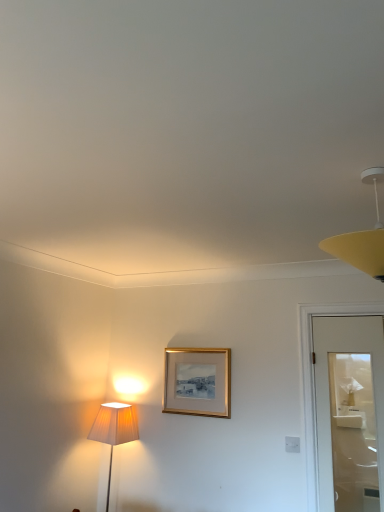
Question: Is yellow matte lampshade at upper right aimed at gold metallic picture frame at center?

Choices:
 (A) no
 (B) yes

Answer: (A)

Question: Can you confirm if yellow matte lampshade at upper right is wider than gold metallic picture frame at center?

Choices:
 (A) yes
 (B) no

Answer: (A)

Question: Can you confirm if yellow matte lampshade at upper right is shorter than gold metallic picture frame at center?

Choices:
 (A) no
 (B) yes

Answer: (B)

Question: Does yellow matte lampshade at upper right have a greater height compared to gold metallic picture frame at center?

Choices:
 (A) yes
 (B) no

Answer: (B)

Question: Considering the relative sizes of yellow matte lampshade at upper right and gold metallic picture frame at center in the image provided, is yellow matte lampshade at upper right thinner than gold metallic picture frame at center?

Choices:
 (A) yes
 (B) no

Answer: (B)

Question: Is yellow matte lampshade at upper right completely or partially outside of gold metallic picture frame at center?

Choices:
 (A) no
 (B) yes

Answer: (B)

Question: Is gold metallic picture frame at center positioned far away from yellow matte lampshade at upper right?

Choices:
 (A) yes
 (B) no

Answer: (A)

Question: Would you say gold metallic picture frame at center is outside yellow matte lampshade at upper right?

Choices:
 (A) yes
 (B) no

Answer: (A)

Question: Is gold metallic picture frame at center bigger than yellow matte lampshade at upper right?

Choices:
 (A) no
 (B) yes

Answer: (A)

Question: Is gold metallic picture frame at center at the left side of yellow matte lampshade at upper right?

Choices:
 (A) yes
 (B) no

Answer: (A)

Question: Is gold metallic picture frame at center positioned with its back to yellow matte lampshade at upper right?

Choices:
 (A) no
 (B) yes

Answer: (A)

Question: Is gold metallic picture frame at center at the right side of yellow matte lampshade at upper right?

Choices:
 (A) yes
 (B) no

Answer: (B)

Question: Does point (168, 365) appear closer or farther from the camera than point (367, 239)?

Choices:
 (A) farther
 (B) closer

Answer: (A)